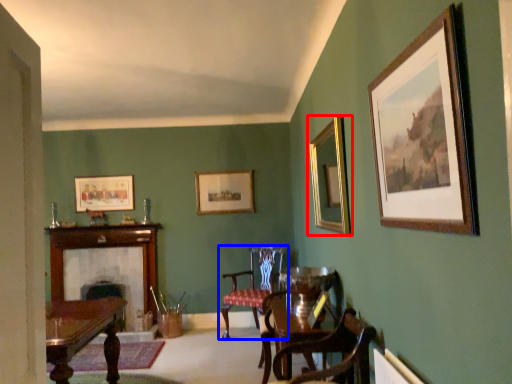
Question: Among these objects, which one is farthest to the camera, picture frame (highlighted by a red box) or chair (highlighted by a blue box)?

Choices:
 (A) picture frame
 (B) chair

Answer: (B)